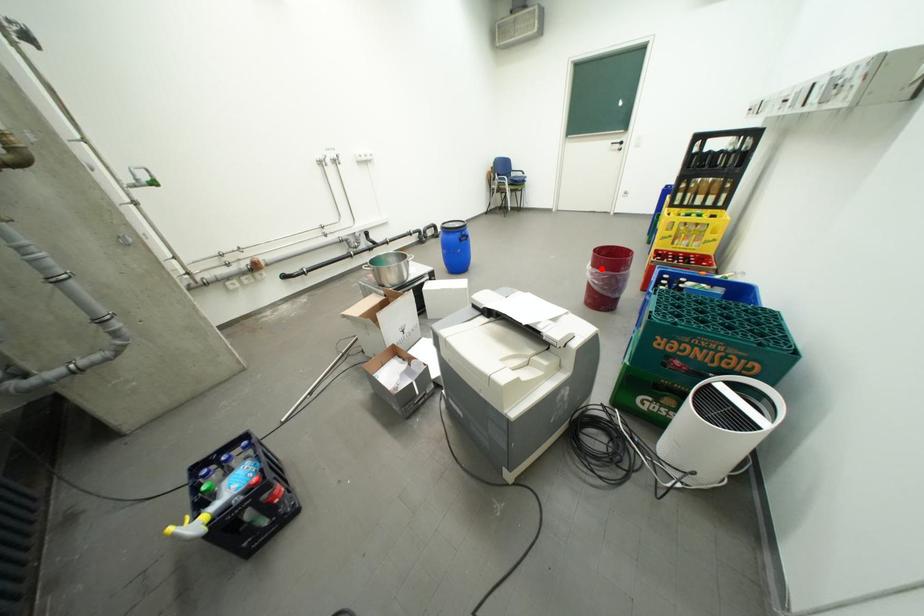
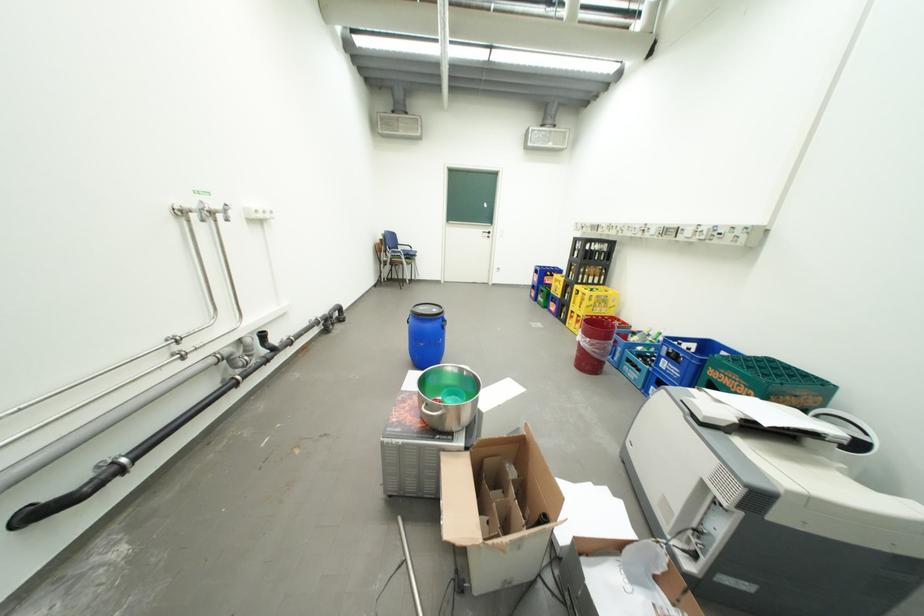
Locate, in the second image, the point that corresponds to the highlighted location in the first image.

(599, 341)